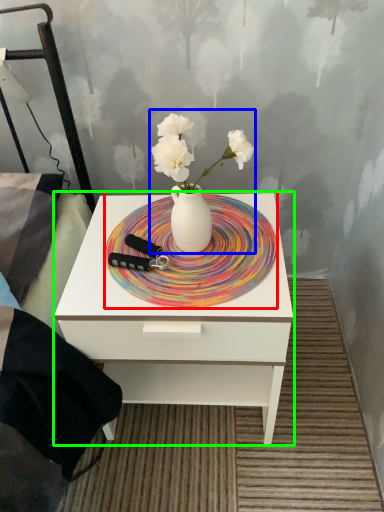
Question: Considering the real-world distances, which object is farthest from plate (highlighted by a red box)? floral arrangement (highlighted by a blue box) or nightstand (highlighted by a green box)?

Choices:
 (A) floral arrangement
 (B) nightstand

Answer: (B)